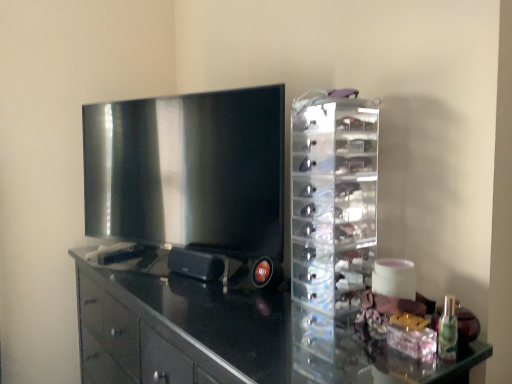
Question: Which is correct: glossy black cabinet at center is inside matte black tv at left, or outside of it?

Choices:
 (A) inside
 (B) outside

Answer: (B)

Question: From the image's perspective, is glossy black cabinet at center above or below matte black tv at left?

Choices:
 (A) below
 (B) above

Answer: (A)

Question: Which is farther from the glossy black cabinet at center?

Choices:
 (A) matte black tv at left
 (B) transparent acrylic organizer at right

Answer: (B)

Question: Which object is positioned closest to the matte black tv at left?

Choices:
 (A) glossy black cabinet at center
 (B) transparent acrylic organizer at right

Answer: (A)